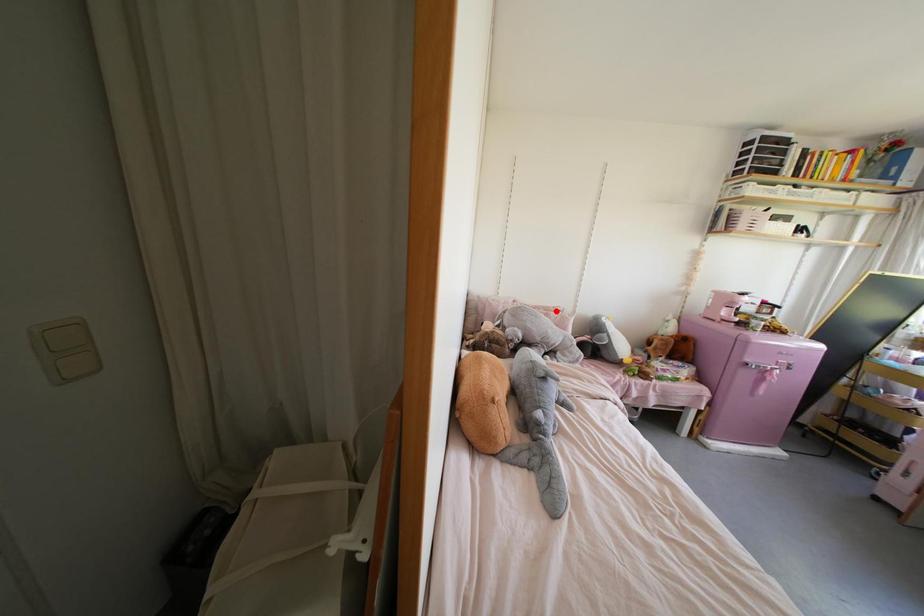
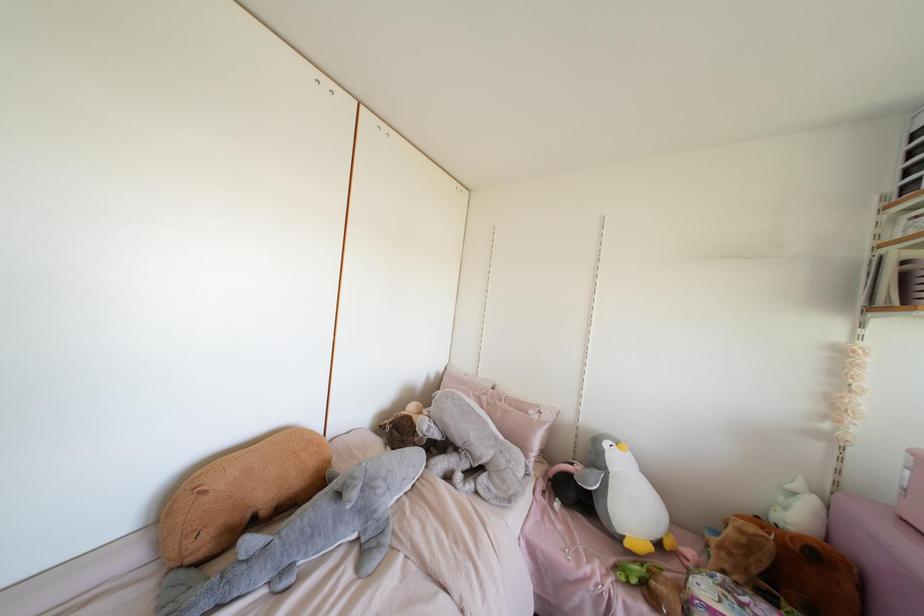
Locate, in the second image, the point that corresponds to the highlighted location in the first image.

(530, 411)